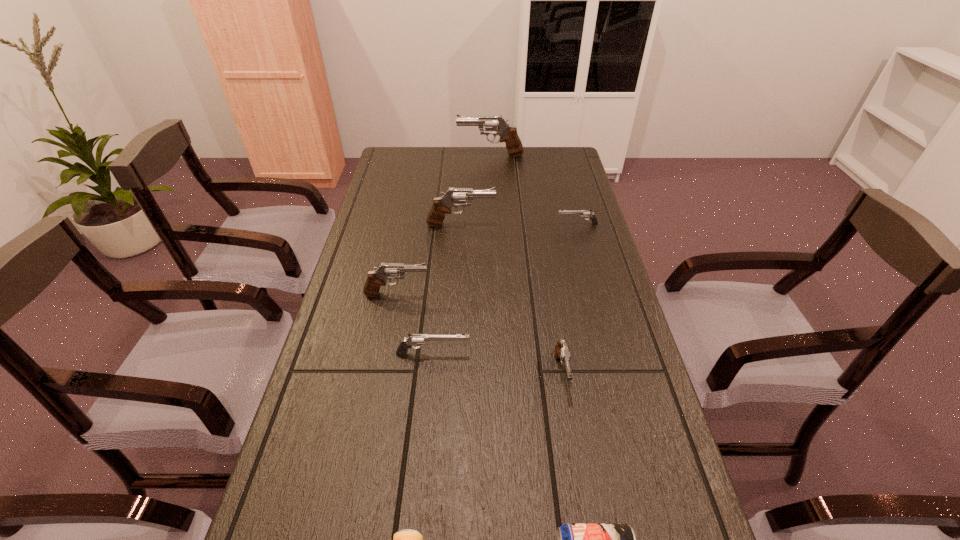
Find the location of a particular element. This screenshot has height=540, width=960. free space located on the front-facing side of the smaller silver pistol is located at coordinates (530, 224).

Find the location of a particular element. Image resolution: width=960 pixels, height=540 pixels. vacant region located 0.270m on the front-facing side of the smaller silver pistol is located at coordinates (475, 224).

In order to click on object at the far edge in this screenshot , I will do `click(508, 134)`.

I want to click on object that is positioned at the left edge, so click(376, 278).

Locate an element on the screen. object that is at the right edge is located at coordinates (584, 213).

In the image, there is a desktop. Where is `vacant space at the far edge`? The width and height of the screenshot is (960, 540). vacant space at the far edge is located at coordinates (495, 173).

You are a GUI agent. You are given a task and a screenshot of the screen. Output one action in this format:
    pyautogui.click(x=<x>, y=<y>)
    Task: Click on the blank area at the left edge
    
    Given the screenshot: What is the action you would take?
    pyautogui.click(x=408, y=200)

Find the location of a particular element. This screenshot has height=540, width=960. vacant space at the right edge is located at coordinates (588, 300).

Find the location of a particular element. The image size is (960, 540). vacant space at the far left corner of the desktop is located at coordinates (419, 175).

The width and height of the screenshot is (960, 540). Identify the location of vacant region at the far right corner of the desktop. (545, 161).